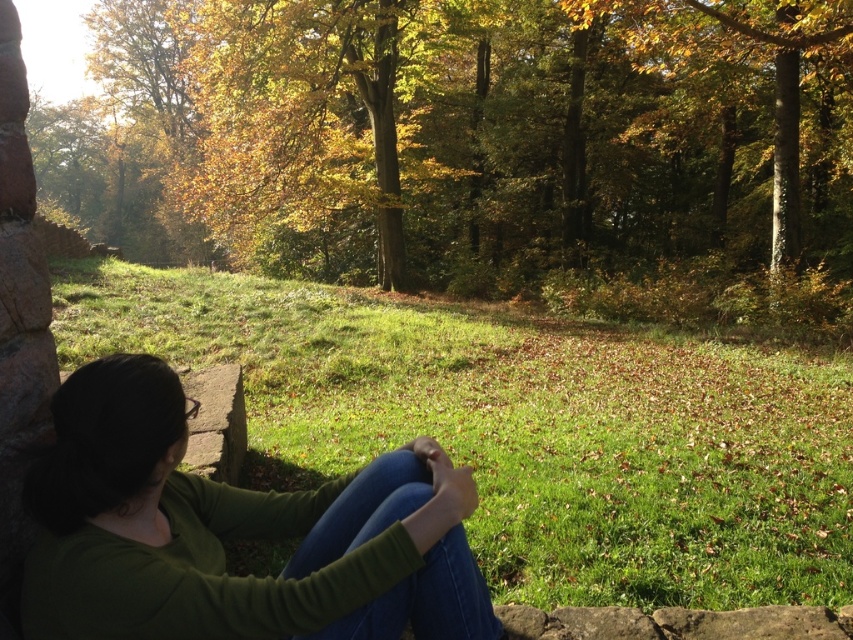
Can you confirm if green leafy tree at upper left is wider than green matte shirt at center?

Yes.

Can you confirm if green leafy tree at upper left is taller than green matte shirt at center?

Indeed, green leafy tree at upper left has a greater height compared to green matte shirt at center.

The image size is (853, 640). Describe the element at coordinates (474, 145) in the screenshot. I see `green leafy tree at upper left` at that location.

I want to click on green leafy tree at upper left, so click(474, 145).

Is point (351, 108) more distant than point (207, 385)?

Yes, point (351, 108) is behind point (207, 385).

Can you confirm if green leafy tree at upper left is smaller than gray concrete stone at left?

Actually, green leafy tree at upper left might be larger than gray concrete stone at left.

At what (x,y) coordinates should I click in order to perform the action: click on green leafy tree at upper left. Please return your answer as a coordinate pair (x, y). Looking at the image, I should click on (474, 145).

Identify the location of green leafy tree at upper left. (474, 145).

Is point (418, 99) positioned after point (770, 250)?

Yes, point (418, 99) is behind point (770, 250).

Can you confirm if green leafy tree at upper left is wider than golden leafy tree at center?

Indeed, green leafy tree at upper left has a greater width compared to golden leafy tree at center.

Who is more forward, [698,122] or [727,168]?

Point [698,122]

The width and height of the screenshot is (853, 640). I want to click on green leafy tree at upper left, so click(474, 145).